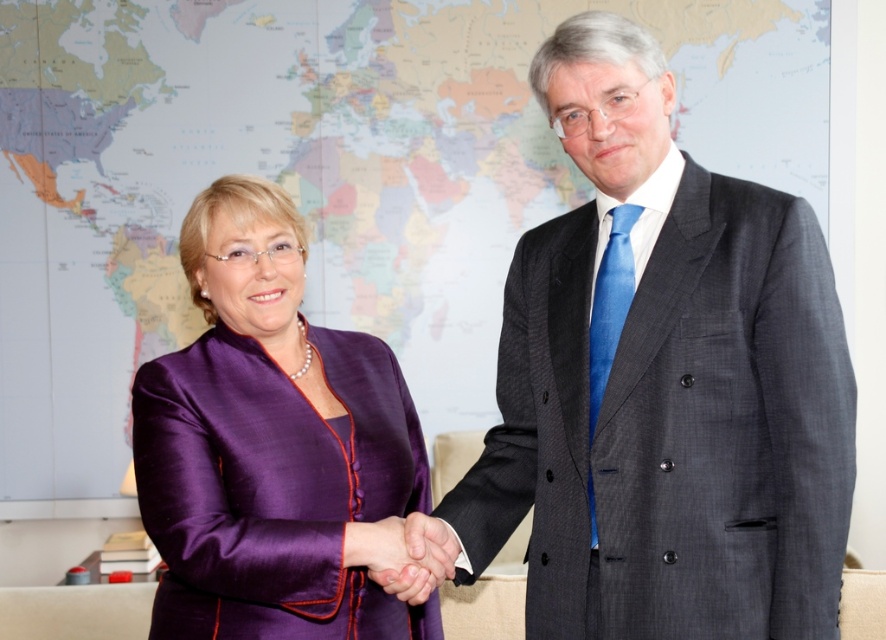
Question: Among these objects, which one is nearest to the camera?

Choices:
 (A) purple silk hand at center
 (B) dark gray suit at center
 (C) matte paper map at center

Answer: (B)

Question: Is purple silk dress at left closer to camera compared to purple silk hand at center?

Choices:
 (A) yes
 (B) no

Answer: (A)

Question: Among these points, which one is nearest to the camera?

Choices:
 (A) (634, 436)
 (B) (398, 538)

Answer: (A)

Question: Which of the following is the closest to the observer?

Choices:
 (A) purple silk hand at center
 (B) purple silk dress at left
 (C) matte paper map at center
 (D) dark gray suit at center

Answer: (D)

Question: Is matte paper map at center closer to the viewer compared to purple silk hand at center?

Choices:
 (A) no
 (B) yes

Answer: (A)

Question: Is dark gray suit at center thinner than purple silk dress at left?

Choices:
 (A) no
 (B) yes

Answer: (A)